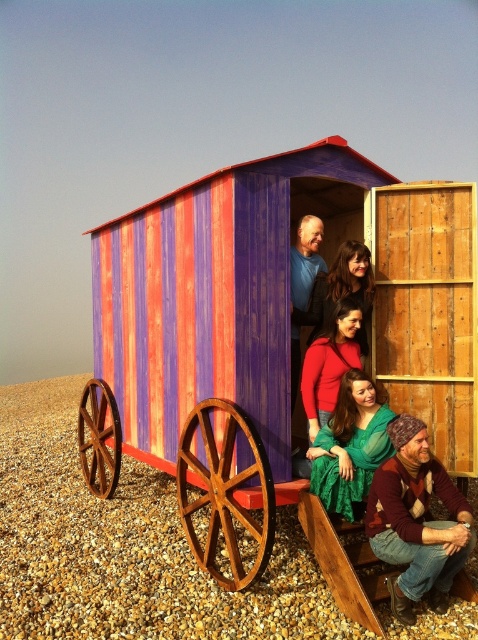
Does wooden cabin at center have a lesser height compared to matte red sweater at center?

No, wooden cabin at center is not shorter than matte red sweater at center.

Describe the element at coordinates (341, 563) in the screenshot. This screenshot has width=478, height=640. I see `wooden cabin at center` at that location.

This screenshot has height=640, width=478. What do you see at coordinates (341, 563) in the screenshot?
I see `wooden cabin at center` at bounding box center [341, 563].

The width and height of the screenshot is (478, 640). Identify the location of wooden cabin at center. (341, 563).

Who is positioned more to the right, knitted woolen hat at lower right or green sheer dress at center?

From the viewer's perspective, knitted woolen hat at lower right appears more on the right side.

Can you confirm if knitted woolen hat at lower right is positioned to the left of green sheer dress at center?

No, knitted woolen hat at lower right is not to the left of green sheer dress at center.

This screenshot has width=478, height=640. What are the coordinates of `knitted woolen hat at lower right` in the screenshot? It's located at [415, 520].

Does knitted woolen hat at lower right have a greater width compared to wooden cabin at center?

Indeed, knitted woolen hat at lower right has a greater width compared to wooden cabin at center.

Measure the distance between knitted woolen hat at lower right and wooden cabin at center.

The distance of knitted woolen hat at lower right from wooden cabin at center is 4.44 feet.

Identify the location of knitted woolen hat at lower right. (415, 520).

Identify the location of knitted woolen hat at lower right. (415, 520).